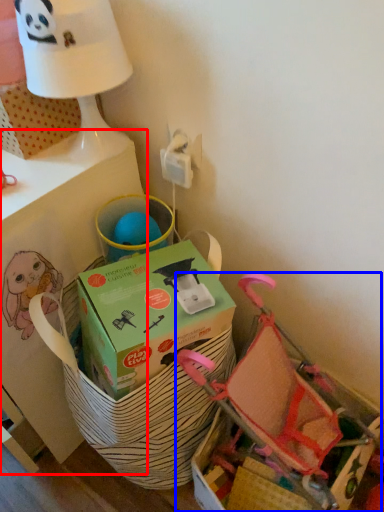
Question: Which object appears farthest to the camera in this image, table (highlighted by a red box) or baby carriage (highlighted by a blue box)?

Choices:
 (A) table
 (B) baby carriage

Answer: (B)